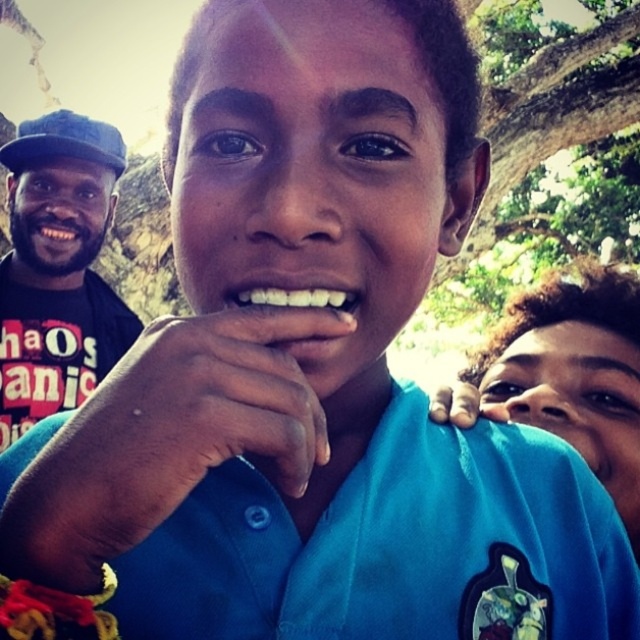
You are standing at point (264, 284) and want to walk to point (100, 172). Is the destination point behind you or in front of you?

The destination point (100, 172) is behind point (264, 284), so it is behind you.

From the picture: You are a photographer trying to capture a group shot. You notice the black fabric shirt at left and the white glossy teeth at center. Which object is positioned to the left of the other?

The black fabric shirt at left is to the left of white glossy teeth at center.

You are standing in the scene and want to move from point A to point B. If point A is at point [572,336] and point B is at point [324,339], which direction should you move to get closer to point B?

To move from point A at point [572,336] to point B at point [324,339], you should move upward because point A is behind point B in the scene.